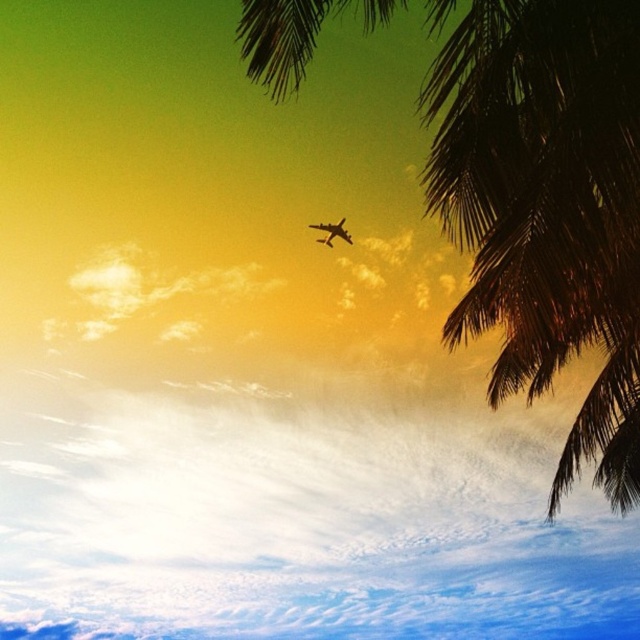
Question: In this image, where is dark green leafy palm tree at upper right located relative to metallic airplane at upper center?

Choices:
 (A) below
 (B) above

Answer: (A)

Question: Which of the following is the farthest from the observer?

Choices:
 (A) dark green leafy palm tree at upper right
 (B) metallic airplane at upper center

Answer: (B)

Question: Which point appears closest to the camera in this image?

Choices:
 (A) (595, 156)
 (B) (316, 227)

Answer: (A)

Question: In this image, where is dark green leafy palm tree at upper right located relative to metallic airplane at upper center?

Choices:
 (A) below
 (B) above

Answer: (A)

Question: Is dark green leafy palm tree at upper right positioned behind metallic airplane at upper center?

Choices:
 (A) no
 (B) yes

Answer: (A)

Question: Among these objects, which one is farthest from the camera?

Choices:
 (A) metallic airplane at upper center
 (B) dark green leafy palm tree at upper right

Answer: (A)